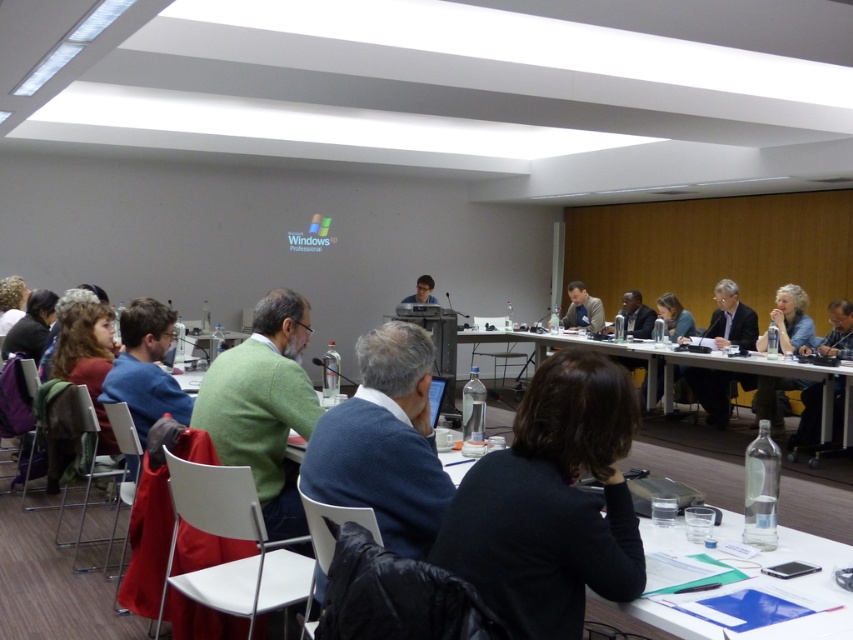
You are organizing a presentation and need to place a 12 inch by 12 inch square box on the table. The table currently has the light brown leather jacket at center and the matte black laptop at center. Can both items fit on the table with the box placed between them?

The light brown leather jacket at center has a larger size compared to matte black laptop at center. However, without knowing the exact dimensions of the table or the space between the two items, it is impossible to determine if the box will fit. More information is needed about the table size and current spacing between the objects.

You are a photographer standing behind the attendees and want to capture a photo of both the dark suit at right and the blue denim jacket at right in the same frame. Given that your camera has a maximum focus range of 16 inches, will you be able to include both subjects in the photo without moving closer?

The distance between the dark suit at right and the blue denim jacket at right is 16.76 inches, which exceeds the camera maximum focus range of 16 inches. Therefore, you cannot include both subjects in the photo without moving closer.